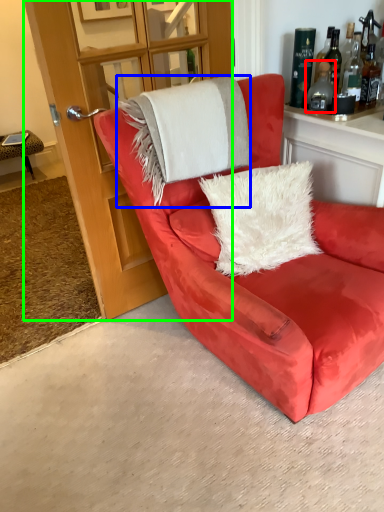
Question: Which object is the farthest from bottle (highlighted by a red box)? Choose among these: blanket (highlighted by a blue box) or glass door (highlighted by a green box).

Choices:
 (A) blanket
 (B) glass door

Answer: (B)